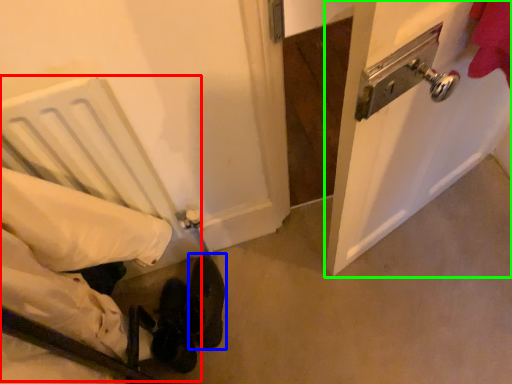
Question: Which is nearer to the bed (highlighted by a red box)? footwear (highlighted by a blue box) or door (highlighted by a green box).

Choices:
 (A) footwear
 (B) door

Answer: (A)